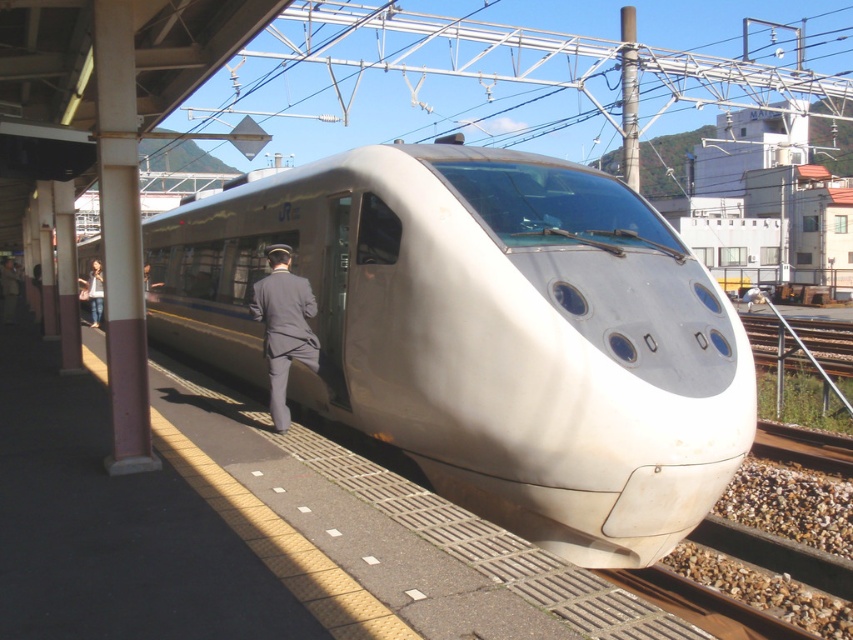
Is white glossy train at center above denim jacket at left?

Correct, white glossy train at center is located above denim jacket at left.

Does point (438, 381) lie in front of point (100, 316)?

Yes.

The width and height of the screenshot is (853, 640). Find the location of `white glossy train at center`. white glossy train at center is located at coordinates pos(485,333).

Does white glossy train at center have a smaller size compared to dark gray uniform at center?

No.

Which is more to the left, white glossy train at center or dark gray uniform at center?

white glossy train at center

Which is in front, point (344, 212) or point (296, 349)?

Point (296, 349) is more forward.

Locate an element on the screen. This screenshot has height=640, width=853. white glossy train at center is located at coordinates click(x=485, y=333).

Can you confirm if dark gray uniform at center is bigger than denim jacket at left?

No.

Between dark gray uniform at center and denim jacket at left, which one has more height?

dark gray uniform at center is taller.

Is point (264, 276) less distant than point (93, 291)?

That is True.

Locate an element on the screen. This screenshot has width=853, height=640. dark gray uniform at center is located at coordinates (283, 326).